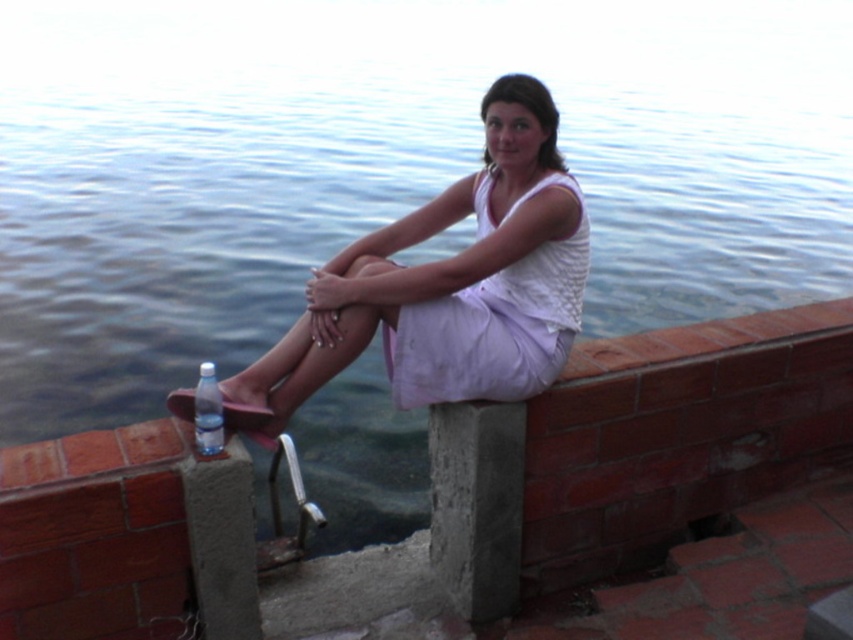
Which is in front, point (541, 326) or point (399, 380)?

Positioned in front is point (399, 380).

Is white matte dress at center to the right of white cotton dress at center from the viewer's perspective?

Incorrect, white matte dress at center is not on the right side of white cotton dress at center.

Does point (444, 312) come farther from viewer compared to point (444, 356)?

No, (444, 312) is closer to viewer.

The image size is (853, 640). In order to click on white matte dress at center in this screenshot , I will do point(450,282).

Consider the image. Does white matte dress at center appear under clear plastic bottle at lower left?

Actually, white matte dress at center is above clear plastic bottle at lower left.

The image size is (853, 640). What do you see at coordinates (450, 282) in the screenshot?
I see `white matte dress at center` at bounding box center [450, 282].

Locate an element on the screen. This screenshot has height=640, width=853. white matte dress at center is located at coordinates (450, 282).

Measure the distance between blue water at center and camera.

blue water at center and camera are 17.66 feet apart from each other.

Can you confirm if blue water at center is wider than clear plastic bottle at lower left?

Correct, the width of blue water at center exceeds that of clear plastic bottle at lower left.

Is point (641, 131) positioned after point (218, 426)?

That is True.

Where is `blue water at center`? blue water at center is located at coordinates (386, 168).